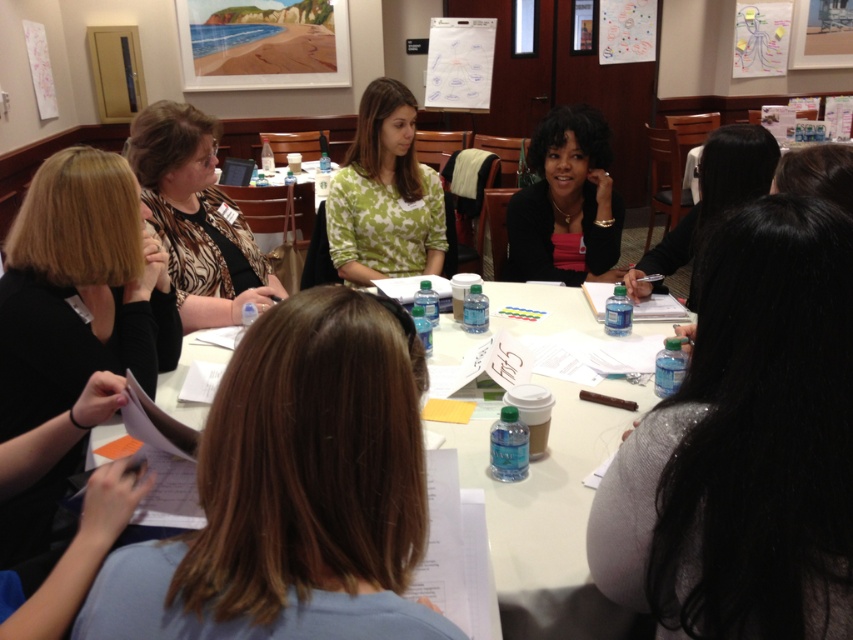
Who is positioned more to the left, green floral shirt at center or white paperboard at upper center?

Positioned to the left is green floral shirt at center.

Is point (367, 246) positioned before point (459, 42)?

Yes, it is in front of point (459, 42).

What are the coordinates of `green floral shirt at center` in the screenshot? It's located at (384, 195).

Can you confirm if gray fabric shirt at lower right is thinner than black hair at center?

Correct, gray fabric shirt at lower right's width is less than black hair at center's.

From the picture: Between gray fabric shirt at lower right and black hair at center, which one is positioned higher?

Positioned higher is black hair at center.

Is point (753, 349) less distant than point (659, 248)?

Yes, point (753, 349) is in front of point (659, 248).

Locate an element on the screen. gray fabric shirt at lower right is located at coordinates (746, 445).

In the scene shown: Who is shorter, gray fabric shirt at lower right or black matte hair at left?

Standing shorter between the two is gray fabric shirt at lower right.

Can you confirm if gray fabric shirt at lower right is wider than black matte hair at left?

Incorrect, gray fabric shirt at lower right's width does not surpass black matte hair at left's.

Locate an element on the screen. gray fabric shirt at lower right is located at coordinates (746, 445).